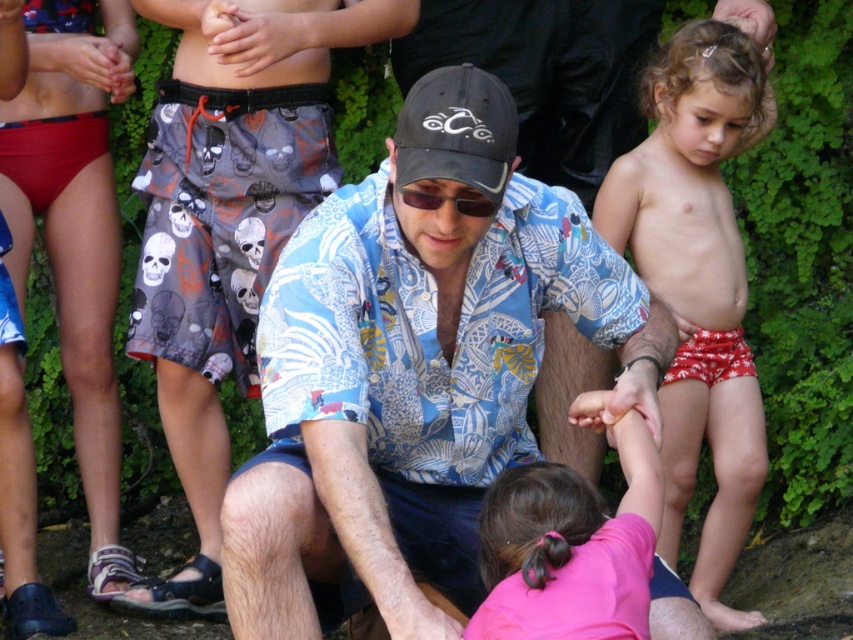
Is printed cotton shirt at center smaller than black fabric baseball cap at center?

Incorrect, printed cotton shirt at center is not smaller in size than black fabric baseball cap at center.

Who is shorter, printed cotton shirt at center or black fabric baseball cap at center?

black fabric baseball cap at center is shorter.

Which is in front, point (256, 528) or point (422, 148)?

Positioned in front is point (256, 528).

Identify the location of printed cotton shirt at center. This screenshot has height=640, width=853. (415, 371).

Can you confirm if printed cotton shirt at center is positioned above sunglasses at center?

Incorrect, printed cotton shirt at center is not positioned above sunglasses at center.

Is point (399, 600) more distant than point (479, 200)?

No, (399, 600) is in front of (479, 200).

What are the coordinates of `printed cotton shirt at center` in the screenshot? It's located at point(415,371).

Can you confirm if black fabric baseball cap at center is taller than sunglasses at center?

Indeed, black fabric baseball cap at center has a greater height compared to sunglasses at center.

How far apart are black fabric baseball cap at center and sunglasses at center?

black fabric baseball cap at center is 4.90 inches away from sunglasses at center.

Identify the location of black fabric baseball cap at center. Image resolution: width=853 pixels, height=640 pixels. (457, 131).

Where is `black fabric baseball cap at center`? This screenshot has width=853, height=640. black fabric baseball cap at center is located at coordinates (457, 131).